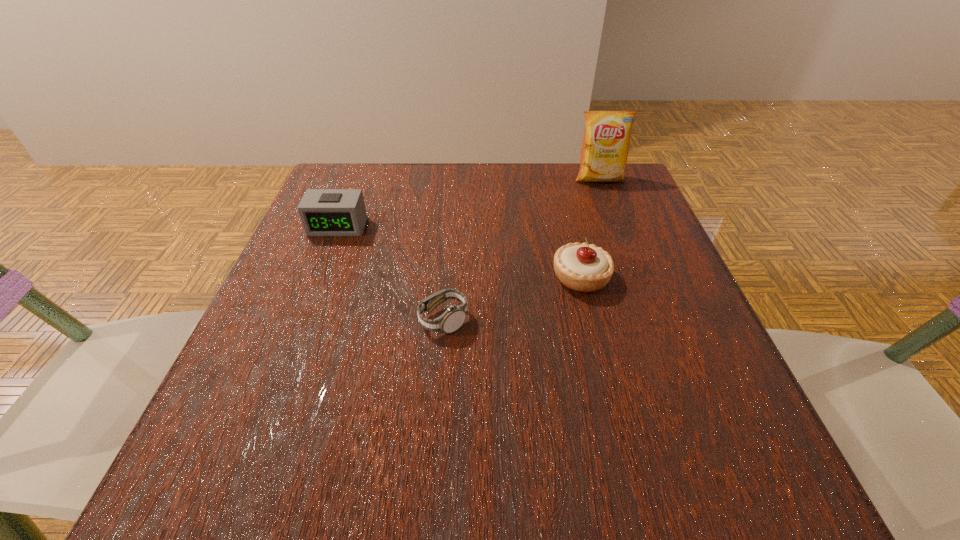
At what (x,y) coordinates should I click in order to perform the action: click on free spot between the farthest object and the shortest object. Please return your answer as a coordinate pair (x, y). Looking at the image, I should click on (521, 249).

Image resolution: width=960 pixels, height=540 pixels. Identify the location of free space between the farthest object and the watch. (521, 249).

Where is `vacant area that lies between the crisp (potato chip) and the shortest object`? The height and width of the screenshot is (540, 960). vacant area that lies between the crisp (potato chip) and the shortest object is located at coordinates (521, 249).

This screenshot has height=540, width=960. What are the coordinates of `free space between the alarm clock and the tallest object` in the screenshot? It's located at (468, 202).

Identify which object is the second nearest to the second nearest object. Please provide its 2D coordinates. Your answer should be formatted as a tuple, i.e. [(x, y)], where the tuple contains the x and y coordinates of a point satisfying the conditions above.

[(605, 146)]

This screenshot has height=540, width=960. What are the coordinates of `the third closest object to the second nearest object` in the screenshot? It's located at (324, 212).

Find the location of a particular element. This screenshot has height=540, width=960. free space that satisfies the following two spatial constraints: 1. on the front side of the third farthest object; 2. on the face of the nearest object is located at coordinates (591, 320).

Locate an element on the screen. The width and height of the screenshot is (960, 540). free location that satisfies the following two spatial constraints: 1. on the front-facing side of the second nearest object; 2. on the right side of the alarm clock is located at coordinates (318, 278).

Locate an element on the screen. vacant space that satisfies the following two spatial constraints: 1. on the front-facing side of the leftmost object; 2. on the right side of the second nearest object is located at coordinates (318, 278).